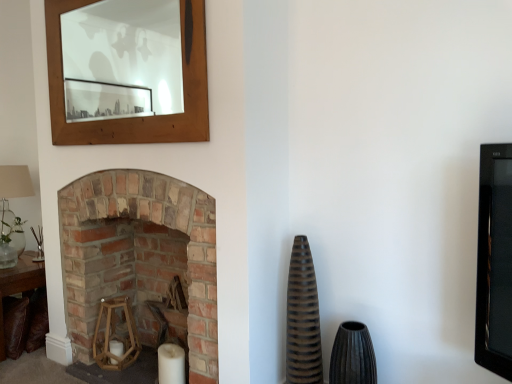
Question: Would you say brown leather table at lower left is a long distance from brown ribbed vase at center-right, the 1th vase viewed from the left?

Choices:
 (A) yes
 (B) no

Answer: (A)

Question: Does brown leather table at lower left have a larger size compared to brown ribbed vase at center-right, which is counted as the second vase, starting from the right?

Choices:
 (A) yes
 (B) no

Answer: (A)

Question: From a real-world perspective, is brown leather table at lower left positioned over brown ribbed vase at center-right, which is counted as the second vase, starting from the right, based on gravity?

Choices:
 (A) no
 (B) yes

Answer: (A)

Question: Is brown leather table at lower left looking in the opposite direction of brown ribbed vase at center-right, which is counted as the second vase, starting from the right?

Choices:
 (A) no
 (B) yes

Answer: (A)

Question: From a real-world perspective, is brown leather table at lower left below brown ribbed vase at center-right, which is counted as the second vase, starting from the right?

Choices:
 (A) yes
 (B) no

Answer: (A)

Question: Is brown ribbed vase at center-right, which is counted as the second vase, starting from the right, completely or partially inside brown leather table at lower left?

Choices:
 (A) yes
 (B) no

Answer: (B)

Question: Is wooden frame at upper left beside translucent glass lampshade at left?

Choices:
 (A) no
 (B) yes

Answer: (A)

Question: Does wooden frame at upper left have a greater height compared to translucent glass lampshade at left?

Choices:
 (A) no
 (B) yes

Answer: (B)

Question: Does wooden frame at upper left turn towards translucent glass lampshade at left?

Choices:
 (A) no
 (B) yes

Answer: (A)

Question: Is wooden frame at upper left smaller than translucent glass lampshade at left?

Choices:
 (A) yes
 (B) no

Answer: (A)

Question: Is translucent glass lampshade at left a part of wooden frame at upper left?

Choices:
 (A) yes
 (B) no

Answer: (B)

Question: From the image's perspective, is wooden frame at upper left below translucent glass lampshade at left?

Choices:
 (A) no
 (B) yes

Answer: (A)

Question: Can you confirm if brick fireplace at left is bigger than matte brown vase at center-right, which is counted as the second vase, starting from the left?

Choices:
 (A) no
 (B) yes

Answer: (B)